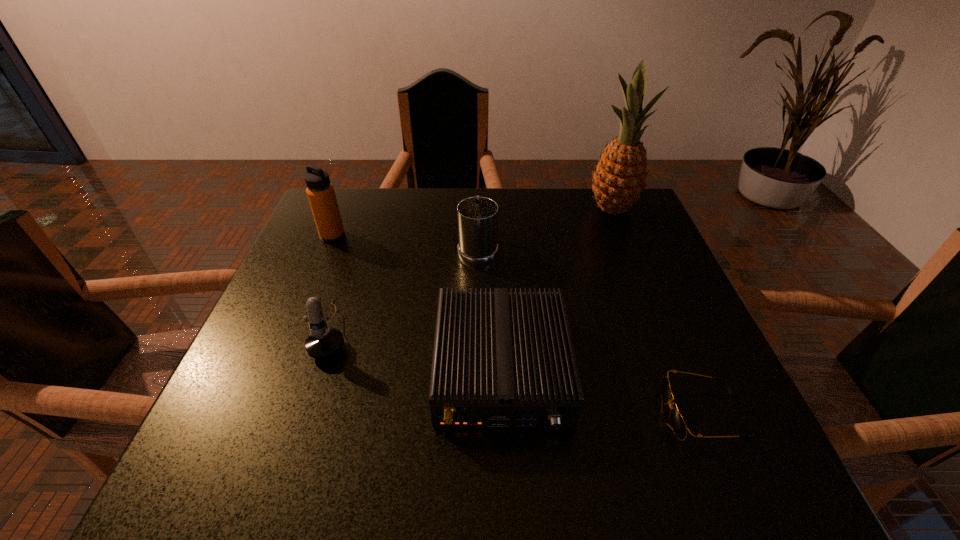
This screenshot has height=540, width=960. I want to click on router at the near edge, so click(501, 359).

You are a GUI agent. You are given a task and a screenshot of the screen. Output one action in this format:
    pyautogui.click(x=<x>, y=<y>)
    Task: Click on the sunglasses that is at the near edge
    This screenshot has width=960, height=540.
    Given the screenshot: What is the action you would take?
    coord(678,424)

At what (x,y) coordinates should I click in order to perform the action: click on thermos bottle located in the left edge section of the desktop. Please return your answer as a coordinate pair (x, y). The height and width of the screenshot is (540, 960). Looking at the image, I should click on pos(320,192).

Where is `microphone that is at the left edge`? This screenshot has width=960, height=540. microphone that is at the left edge is located at coordinates (324, 342).

Find the location of `pineapple that is at the right edge`. pineapple that is at the right edge is located at coordinates (619, 179).

Identify the location of sunglasses present at the right edge. The height and width of the screenshot is (540, 960). (678, 424).

Find the location of a particular element. The image size is (960, 540). object situated at the far left corner is located at coordinates (320, 192).

Identify the location of object that is at the far right corner. This screenshot has width=960, height=540. (619, 179).

Image resolution: width=960 pixels, height=540 pixels. I want to click on object positioned at the near right corner, so 678,424.

Where is `vacant space at the far edge of the desktop`? This screenshot has height=540, width=960. vacant space at the far edge of the desktop is located at coordinates (436, 219).